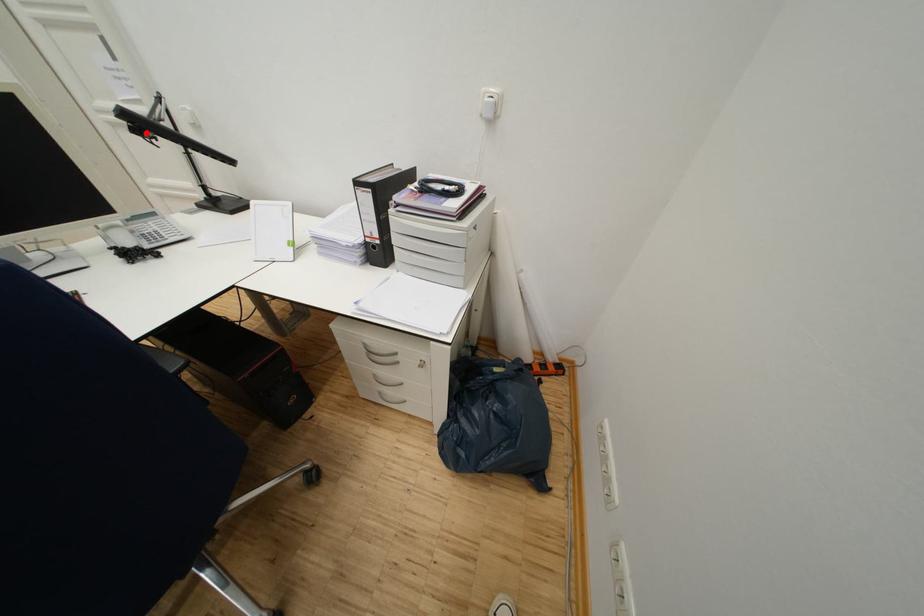
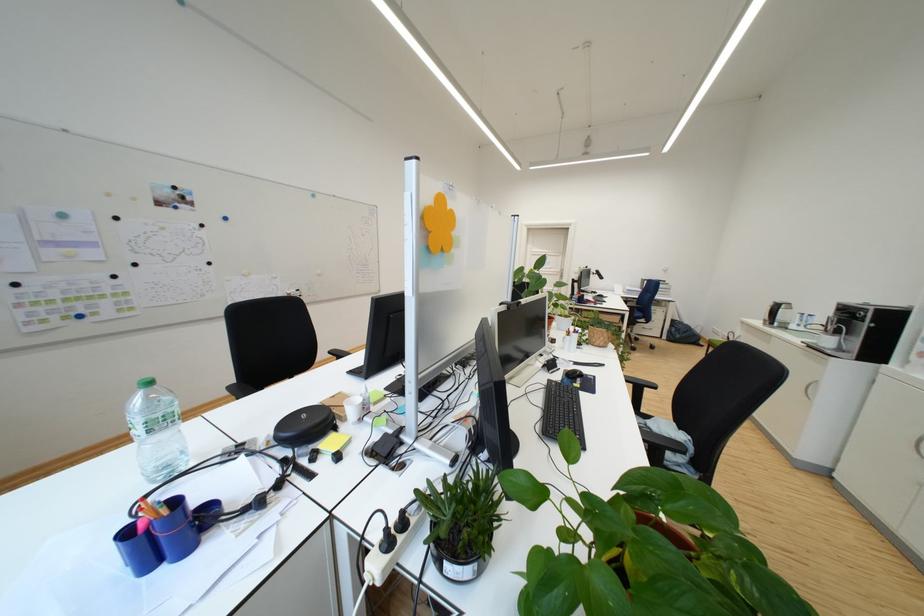
Question: I am providing you with two images of the same scene from different viewpoints. A red point is marked on the first image. At the location where the point appears in image 1, is it still visible in image 2?

Choices:
 (A) Yes
 (B) No

Answer: (B)